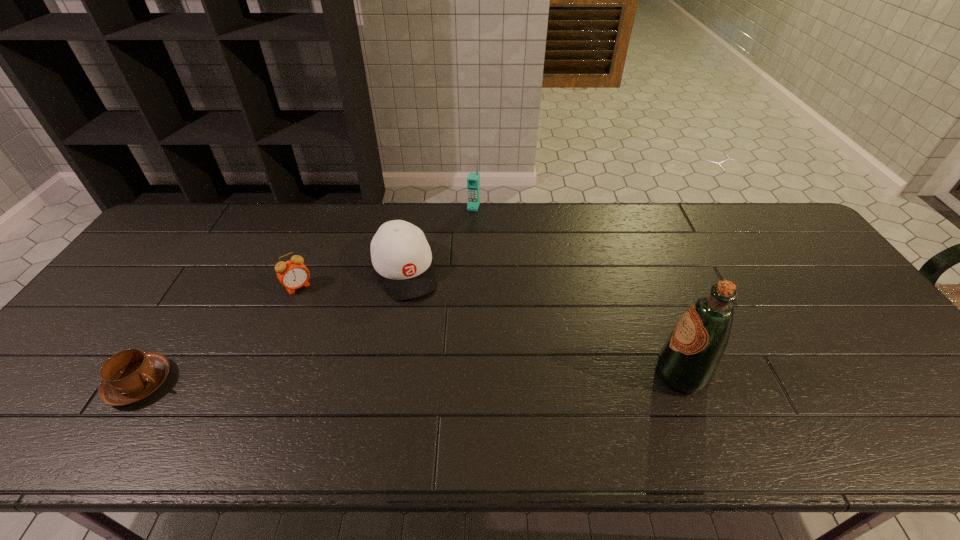
Where is `free area in between the farthest object and the leftmost object`? free area in between the farthest object and the leftmost object is located at coordinates (306, 295).

The height and width of the screenshot is (540, 960). In order to click on free spot between the baseball cap and the alarm clock in this screenshot , I will do `click(351, 279)`.

This screenshot has width=960, height=540. Find the location of `free space between the second object from right to left and the baseball cap`. free space between the second object from right to left and the baseball cap is located at coordinates (439, 239).

This screenshot has width=960, height=540. What are the coordinates of `free space between the leftmost object and the farthest object` in the screenshot? It's located at (306, 295).

The height and width of the screenshot is (540, 960). I want to click on vacant space that's between the rightmost object and the baseball cap, so click(542, 323).

At what (x,y) coordinates should I click in order to perform the action: click on vacant area that lies between the shortest object and the second object from left to right. Please return your answer as a coordinate pair (x, y). Looking at the image, I should click on (219, 335).

Identify the location of vacant space in between the rightmost object and the farthest object. The height and width of the screenshot is (540, 960). (577, 291).

Locate an element on the screen. Image resolution: width=960 pixels, height=540 pixels. free area in between the third object from right to left and the alarm clock is located at coordinates (351, 279).

Identify the location of unoccupied position between the rightmost object and the fourth object from right to left. (490, 330).

Where is `the closest object relative to the cappuccino`? The height and width of the screenshot is (540, 960). the closest object relative to the cappuccino is located at coordinates (293, 274).